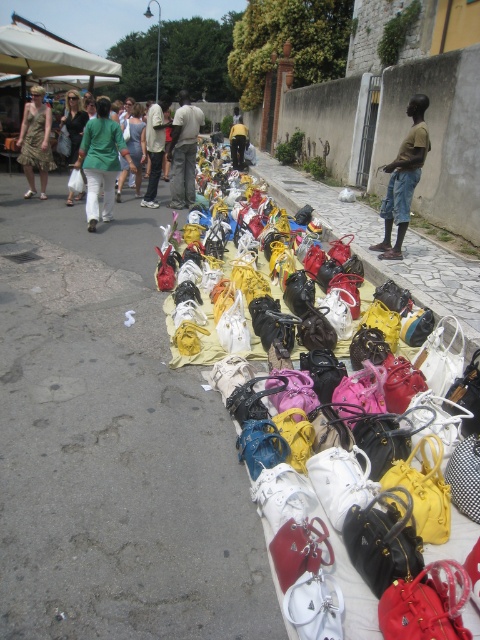
Question: Among these points, which one is farthest from the camera?

Choices:
 (A) (412, 147)
 (B) (180, 205)
 (C) (238, 125)

Answer: (C)

Question: Is matte green shirt at center above matte green dress at left?

Choices:
 (A) yes
 (B) no

Answer: (A)

Question: Which of the following is the closest to the observer?

Choices:
 (A) (244, 145)
 (B) (396, 234)
 (C) (186, 113)
 (D) (4, 36)

Answer: (B)

Question: Which point is farther from the camera taking this photo?

Choices:
 (A) (84, 118)
 (B) (240, 122)

Answer: (B)

Question: Where is white fabric canopy at upper left located in relation to light brown leather pants at center in the image?

Choices:
 (A) below
 (B) above

Answer: (B)

Question: Can you confirm if matte green shirt at center is wider than matte green pants at center?

Choices:
 (A) yes
 (B) no

Answer: (B)